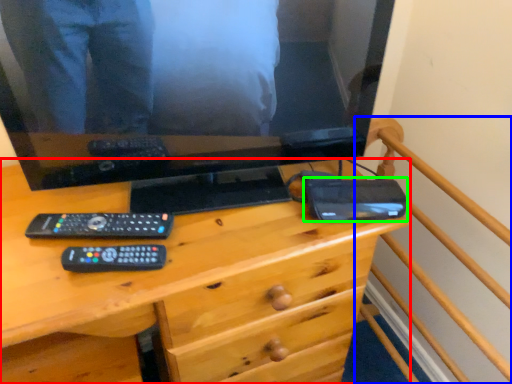
Question: Based on their relative distances, which object is farther from desk (highlighted by a red box)? Choose from bed frame (highlighted by a blue box) and gadget (highlighted by a green box).

Choices:
 (A) bed frame
 (B) gadget

Answer: (A)